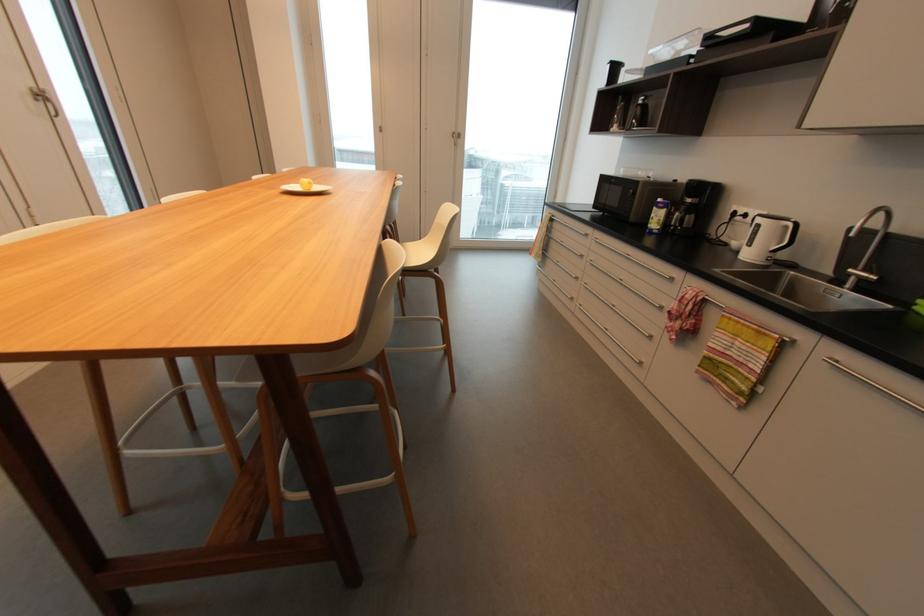
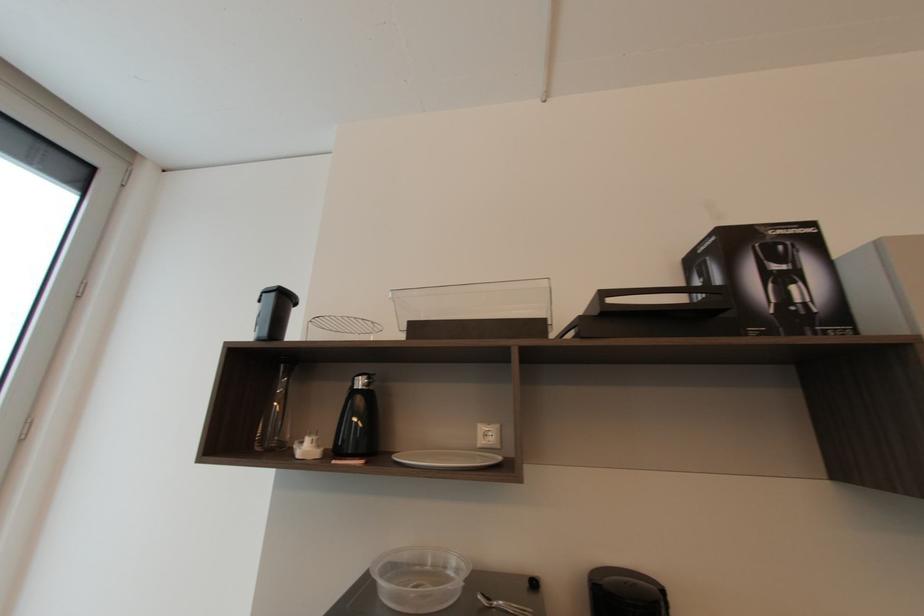
Question: I am providing you with two images of the same scene from different viewpoints. Which of the following objects are not visible in image2?

Choices:
 (A) black canister lid
 (B) glass carafe
 (C) metal spoon
 (D) none of these

Answer: (D)